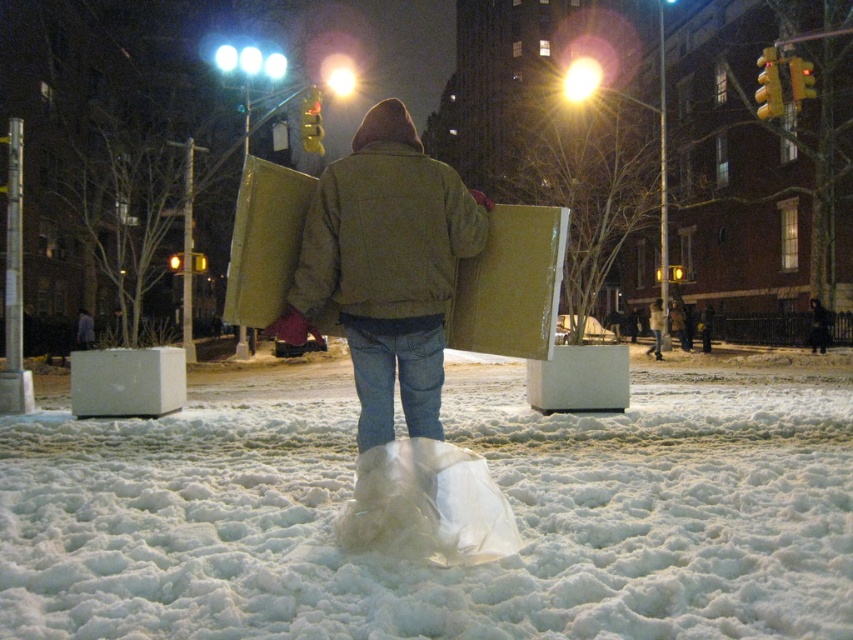
Which is above, white fluffy snow at center or matte brown jacket at center?

Positioned higher is matte brown jacket at center.

At what (x,y) coordinates should I click in order to perform the action: click on white fluffy snow at center. Please return your answer as a coordinate pair (x, y). The width and height of the screenshot is (853, 640). Looking at the image, I should click on (428, 566).